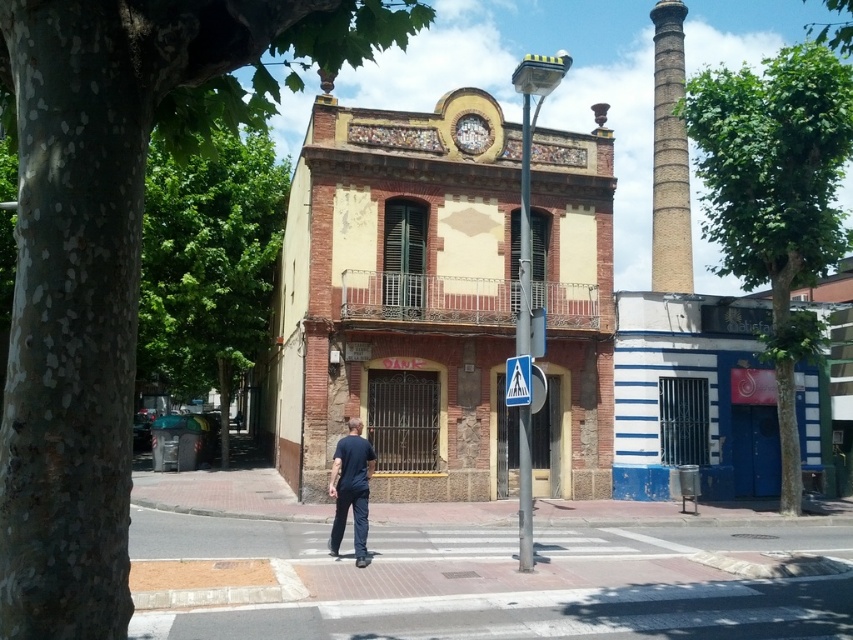
You are a pedestrian standing on the sidewalk in front of the historic building. You see a green leafy tree at left and a dark blue shirt at center. Which object is closer to you?

The green leafy tree at left is closer to the viewer than the dark blue shirt at center.

Based on the photo, you are a pedestrian standing at the edge of the street, looking towards the historic building. You notice the green leafy tree at right and the white plastic pedestrian crossing sign at center. Which object is taller?

The green leafy tree at right is taller than the white plastic pedestrian crossing sign at center.